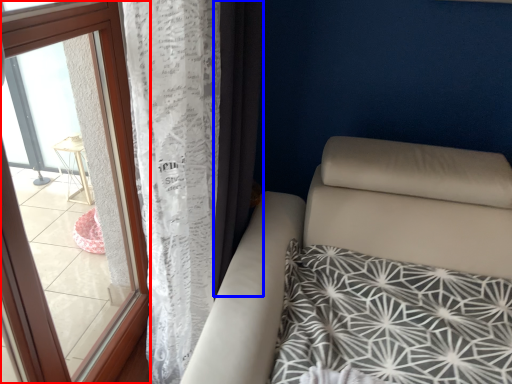
Question: Which object appears farthest to the camera in this image, window (highlighted by a red box) or curtain (highlighted by a blue box)?

Choices:
 (A) window
 (B) curtain

Answer: (B)